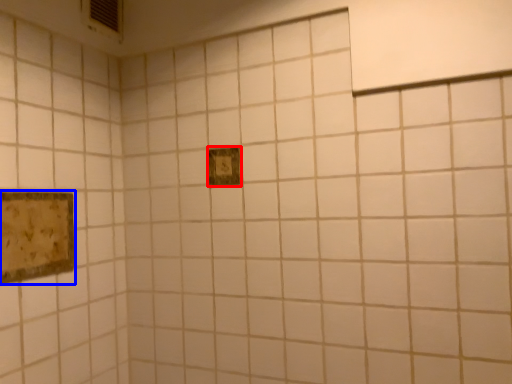
Question: Which object is closer to the camera taking this photo, picture frame (highlighted by a red box) or picture frame (highlighted by a blue box)?

Choices:
 (A) picture frame
 (B) picture frame

Answer: (B)